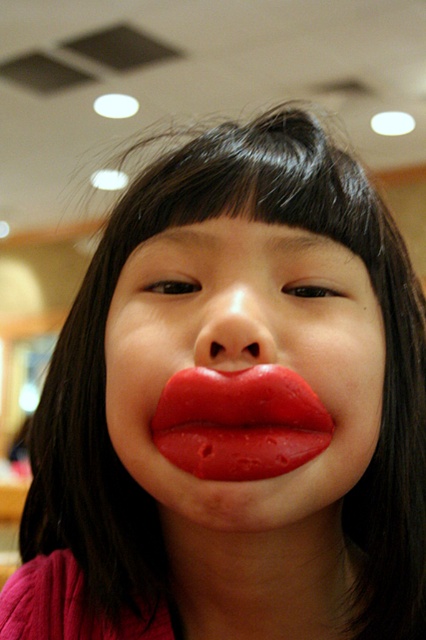
Can you confirm if shiny red lips at center is positioned to the right of smooth skin nose at center?

Yes, shiny red lips at center is to the right of smooth skin nose at center.

Find the location of a particular element. This screenshot has width=426, height=640. shiny red lips at center is located at coordinates (244, 376).

The height and width of the screenshot is (640, 426). Find the location of `shiny red lips at center`. shiny red lips at center is located at coordinates (244, 376).

Between shiny red lips at center and glossy red lips at center, which one appears on the left side from the viewer's perspective?

glossy red lips at center is more to the left.

The width and height of the screenshot is (426, 640). In order to click on shiny red lips at center in this screenshot , I will do `click(244, 376)`.

Find the location of `shiny red lips at center`. shiny red lips at center is located at coordinates click(x=244, y=376).

What do you see at coordinates (239, 422) in the screenshot?
I see `glossy red lips at center` at bounding box center [239, 422].

Who is shorter, glossy red lips at center or smooth skin nose at center?

smooth skin nose at center is shorter.

Between point (249, 404) and point (233, 324), which one is positioned behind?

The point (249, 404) is more distant.

Find the location of a particular element. glossy red lips at center is located at coordinates (239, 422).